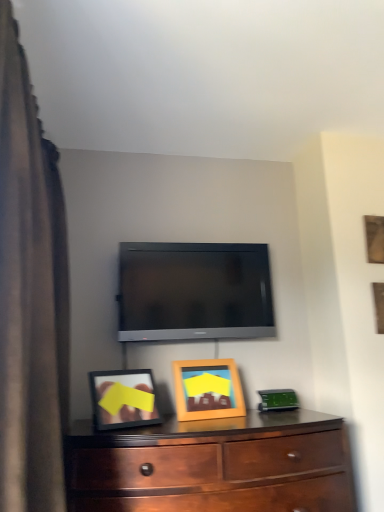
Question: Could you tell me if wooden picture frame at center, marked as the second picture frame in a back-to-front arrangement, is turned towards mahogany wood dresser at lower center?

Choices:
 (A) yes
 (B) no

Answer: (B)

Question: Is wooden picture frame at center, the first picture frame from the front, not close to mahogany wood dresser at lower center?

Choices:
 (A) yes
 (B) no

Answer: (B)

Question: Is wooden picture frame at center, which is the first picture frame from bottom to top, outside of mahogany wood dresser at lower center?

Choices:
 (A) no
 (B) yes

Answer: (B)

Question: Considering the relative sizes of wooden picture frame at center, positioned as the second picture frame in top-to-bottom order, and mahogany wood dresser at lower center in the image provided, is wooden picture frame at center, positioned as the second picture frame in top-to-bottom order, bigger than mahogany wood dresser at lower center?

Choices:
 (A) yes
 (B) no

Answer: (B)

Question: Is wooden picture frame at center, which appears as the second picture frame when viewed from the right, at the right side of mahogany wood dresser at lower center?

Choices:
 (A) no
 (B) yes

Answer: (B)

Question: In terms of height, does brown fabric curtain at left look taller or shorter compared to matte black tv at center?

Choices:
 (A) short
 (B) tall

Answer: (B)

Question: Is brown fabric curtain at left wider or thinner than matte black tv at center?

Choices:
 (A) wide
 (B) thin

Answer: (A)

Question: Is brown fabric curtain at left in front of or behind matte black tv at center in the image?

Choices:
 (A) behind
 (B) front

Answer: (B)

Question: In the image, is brown fabric curtain at left on the left side or the right side of matte black tv at center?

Choices:
 (A) left
 (B) right

Answer: (A)

Question: Is brown fabric curtain at left taller or shorter than wooden picture frame at upper right, positioned as the 1th picture frame in top-to-bottom order?

Choices:
 (A) tall
 (B) short

Answer: (A)

Question: Would you say brown fabric curtain at left is inside or outside wooden picture frame at upper right, acting as the 1th picture frame starting from the right?

Choices:
 (A) outside
 (B) inside

Answer: (A)

Question: In the image, is brown fabric curtain at left positioned in front of or behind wooden picture frame at upper right, the second picture frame from the bottom?

Choices:
 (A) front
 (B) behind

Answer: (A)

Question: From a real-world perspective, is brown fabric curtain at left positioned above or below wooden picture frame at upper right, the second picture frame from the bottom?

Choices:
 (A) below
 (B) above

Answer: (A)

Question: Is matte black tv at center taller or shorter than brown fabric curtain at left?

Choices:
 (A) tall
 (B) short

Answer: (B)

Question: From the image's perspective, is matte black tv at center located above or below brown fabric curtain at left?

Choices:
 (A) below
 (B) above

Answer: (A)